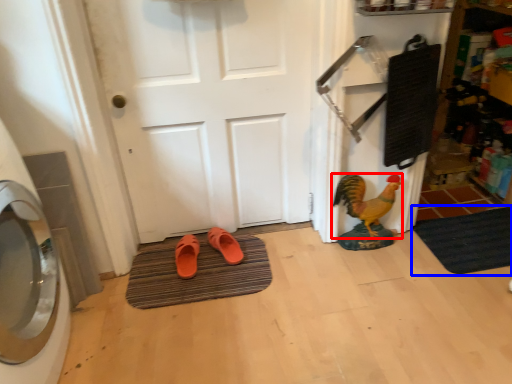
Question: Which point is closer to the camera, chicken (highlighted by a red box) or bath mat (highlighted by a blue box)?

Choices:
 (A) chicken
 (B) bath mat

Answer: (A)